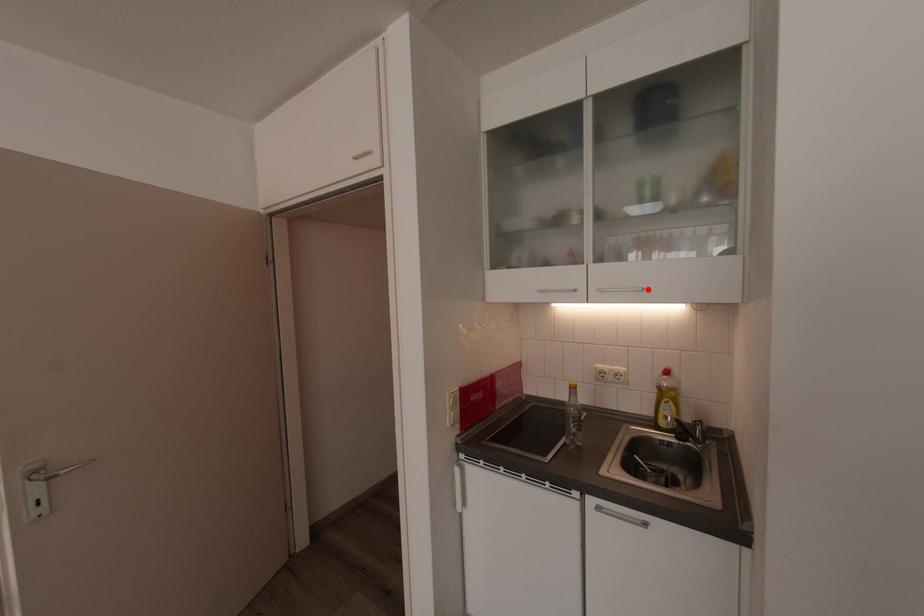
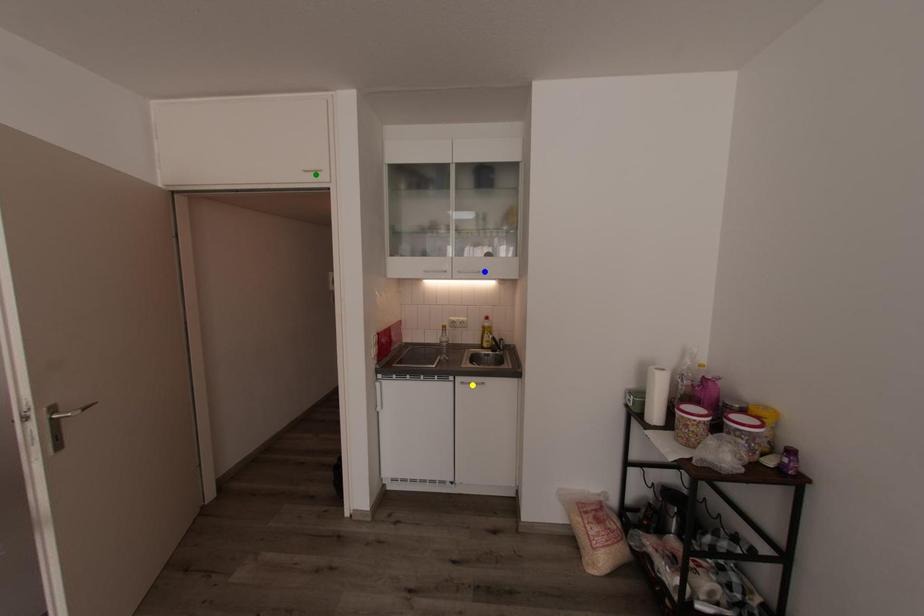
Question: I am providing you with two images of the same scene from different viewpoints. A red point is marked on the first image. You are given multiple points on the second image. Can you choose the point in image 2 that corresponds to the point in image 1?

Choices:
 (A) green point
 (B) yellow point
 (C) blue point

Answer: (C)